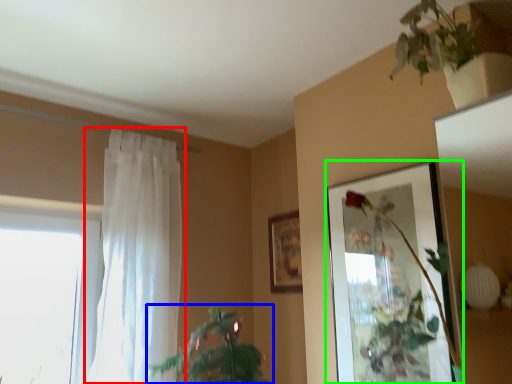
Question: Which object is the farthest from curtain (highlighted by a red box)? Choose among these: houseplant (highlighted by a blue box) or picture frame (highlighted by a green box).

Choices:
 (A) houseplant
 (B) picture frame

Answer: (B)